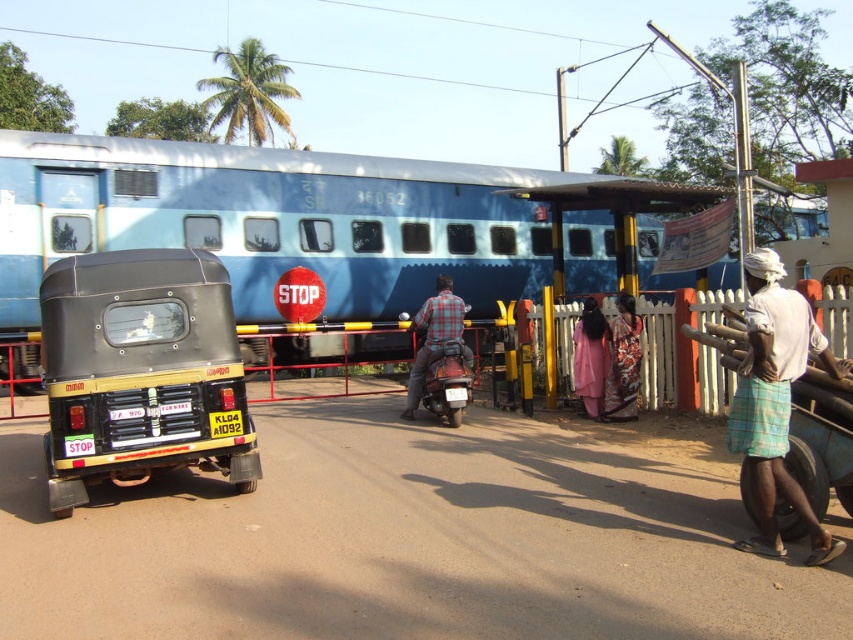
You are a pedestrian standing at the railway crossing and want to cross to the other side. There are two points marked on the ground at coordinates point (242, 173) and point (254, 429). Which point is closer to you as you stand at the starting position?

Point (242, 173) is further to the camera than point (254, 429), so the point closer to you is point (254, 429).